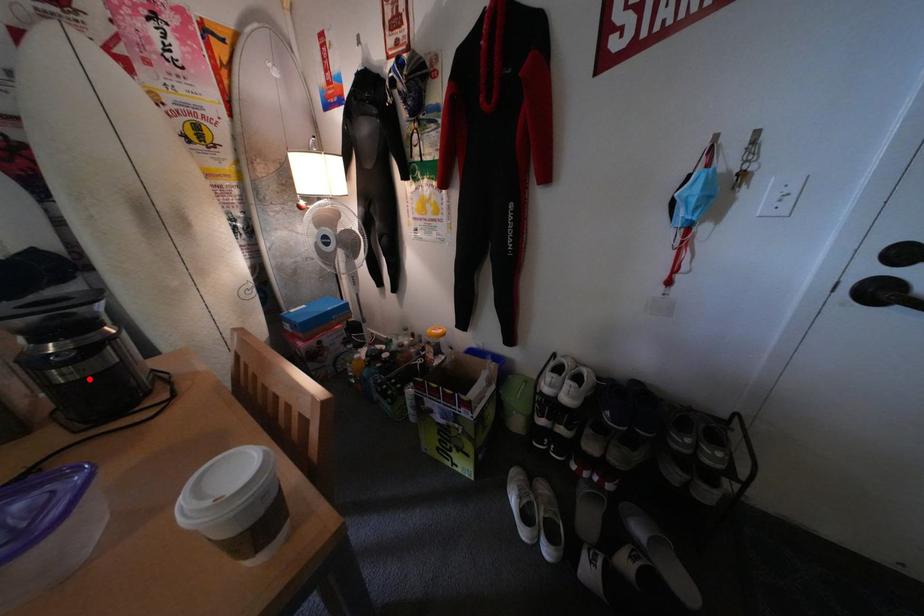
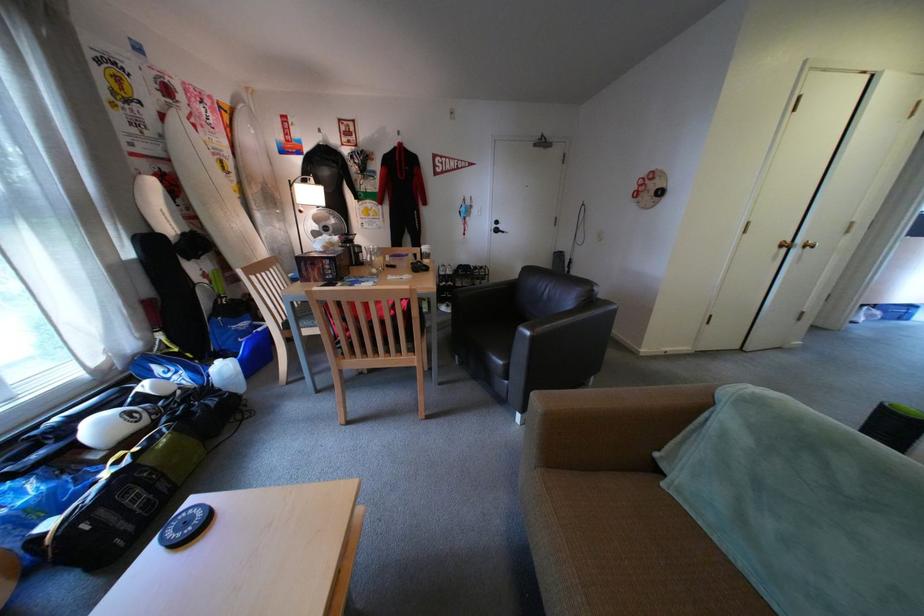
Question: A red point is marked in image1. In image2, is the corresponding 3D point closer to the camera or farther? Reply with the corresponding letter.

Choices:
 (A) The corresponding 3D point is closer.
 (B) The corresponding 3D point is farther.

Answer: (A)